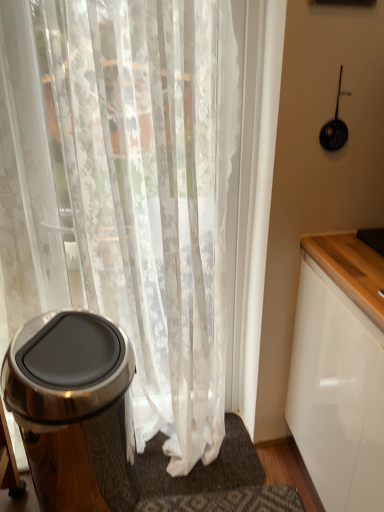
Locate an element on the screen. free point above white textured bath mat at lower center (from a real-world perspective) is located at coordinates [198, 452].